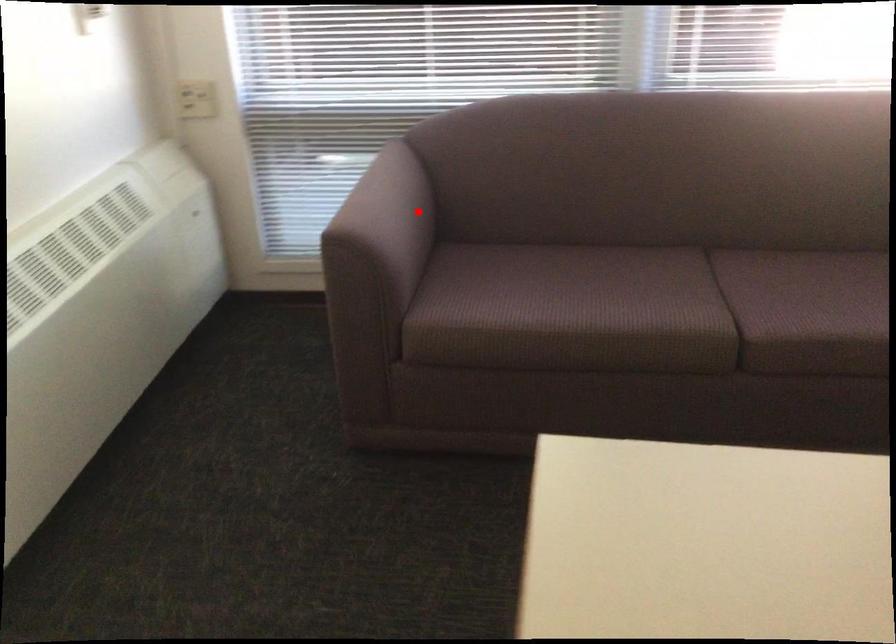
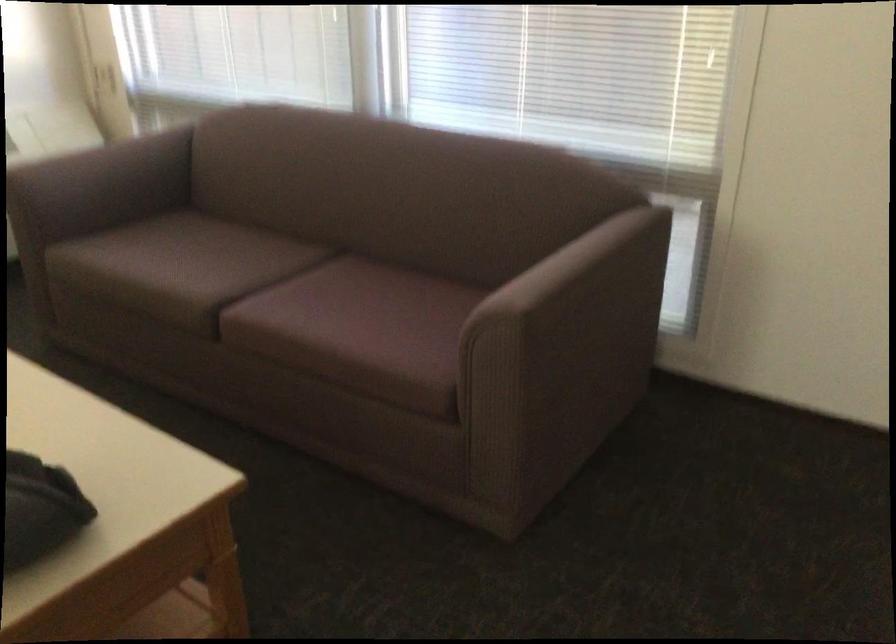
Where in the second image is the point corresponding to the highlighted location from the first image?

(113, 173)